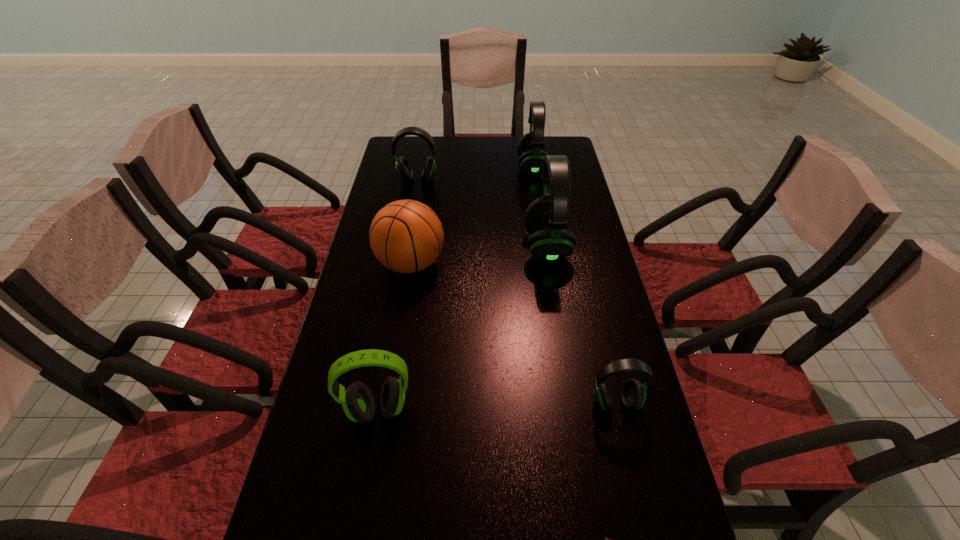
You are a GUI agent. You are given a task and a screenshot of the screen. Output one action in this format:
    pyautogui.click(x=<x>, y=<y>)
    Task: Click on the tallest object
    The width and height of the screenshot is (960, 540).
    Given the screenshot: What is the action you would take?
    pyautogui.click(x=547, y=218)

Locate an element on the screen. the biggest black headset is located at coordinates (547, 218).

Identify the location of the sixth shortest object. This screenshot has width=960, height=540. (532, 147).

The height and width of the screenshot is (540, 960). Find the location of `the third smallest black headset`. the third smallest black headset is located at coordinates (532, 147).

At what (x,y) coordinates should I click in order to perform the action: click on basketball. Please return your answer as a coordinate pair (x, y). The image size is (960, 540). Looking at the image, I should click on click(406, 236).

Image resolution: width=960 pixels, height=540 pixels. I want to click on the third biggest black headset, so click(x=403, y=168).

Locate an element on the screen. green headset is located at coordinates (358, 403).

At what (x,y) coordinates should I click in order to perform the action: click on the smallest black headset. Please return your answer as a coordinate pair (x, y). Looking at the image, I should click on (633, 393).

Locate an element on the screen. the sixth tallest object is located at coordinates (633, 393).

Locate an element on the screen. The height and width of the screenshot is (540, 960). vacant space located 0.300m on the ear cups of the third nearest headset is located at coordinates (429, 247).